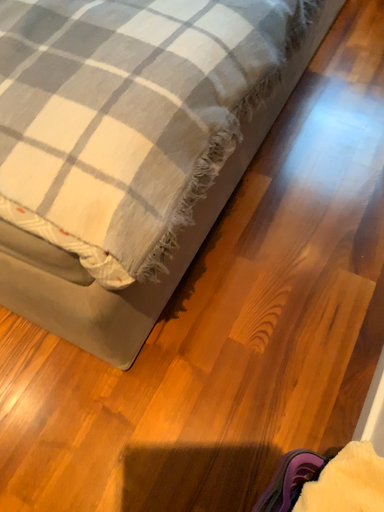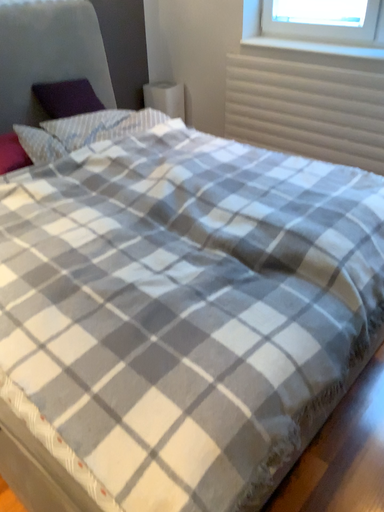
Question: Which way did the camera rotate in the video?

Choices:
 (A) rotated left
 (B) rotated right

Answer: (A)